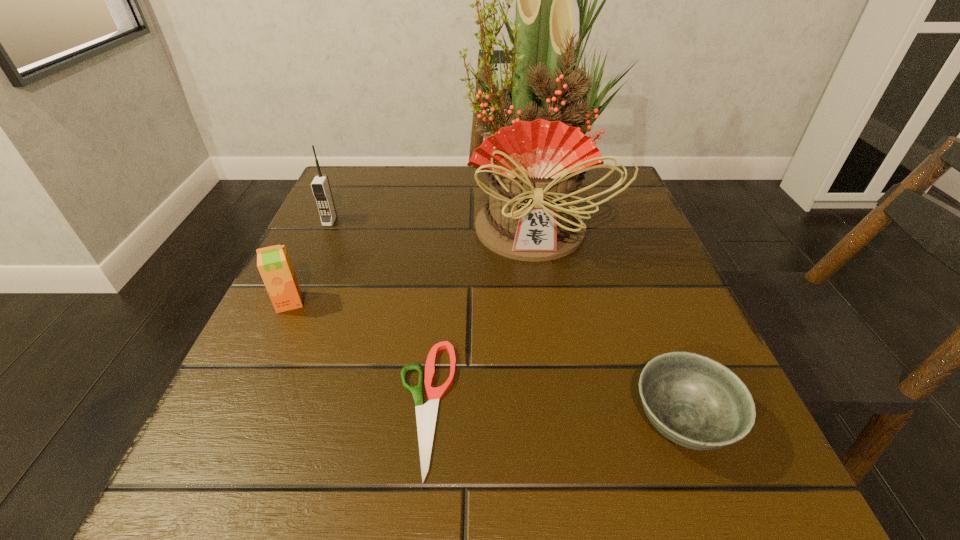
Where is `object that is at the far right corner`? object that is at the far right corner is located at coordinates (535, 162).

This screenshot has width=960, height=540. Find the location of `object located at the near right corner`. object located at the near right corner is located at coordinates (694, 401).

This screenshot has width=960, height=540. I want to click on blank space at the far edge of the desktop, so click(x=458, y=177).

Locate an element on the screen. vacant area at the near edge is located at coordinates (534, 504).

In the image, there is a desktop. In order to click on vacant space at the left edge in this screenshot , I will do `click(300, 330)`.

In the image, there is a desktop. Identify the location of vacant space at the right edge. This screenshot has width=960, height=540. (643, 309).

The image size is (960, 540). What are the coordinates of `vacant space at the far left corner` in the screenshot? It's located at (350, 215).

Image resolution: width=960 pixels, height=540 pixels. I want to click on free space at the near left corner of the desktop, so click(265, 482).

This screenshot has width=960, height=540. In the image, there is a desktop. Identify the location of vacant space at the far right corner. (600, 214).

I want to click on vacant area that lies between the scissors and the third tallest object, so click(x=357, y=354).